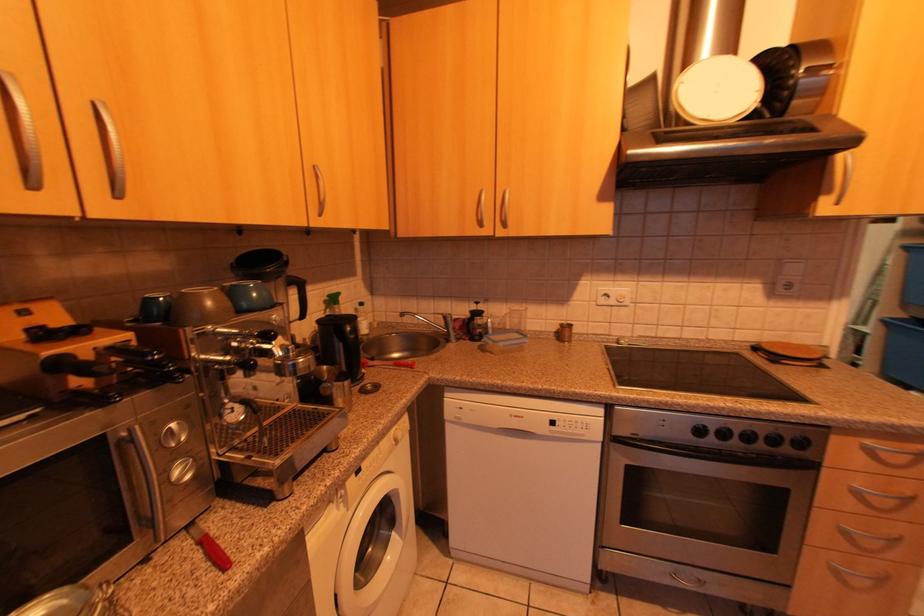
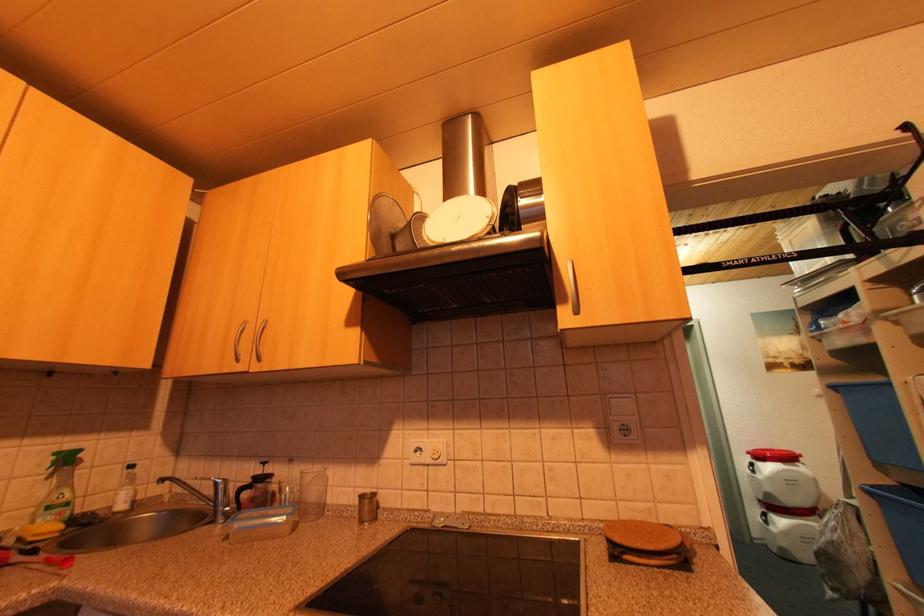
Question: The images are taken continuously from a first-person perspective. In which direction are you moving?

Choices:
 (A) Left
 (B) Right
 (C) Forward
 (D) Backward

Answer: (B)